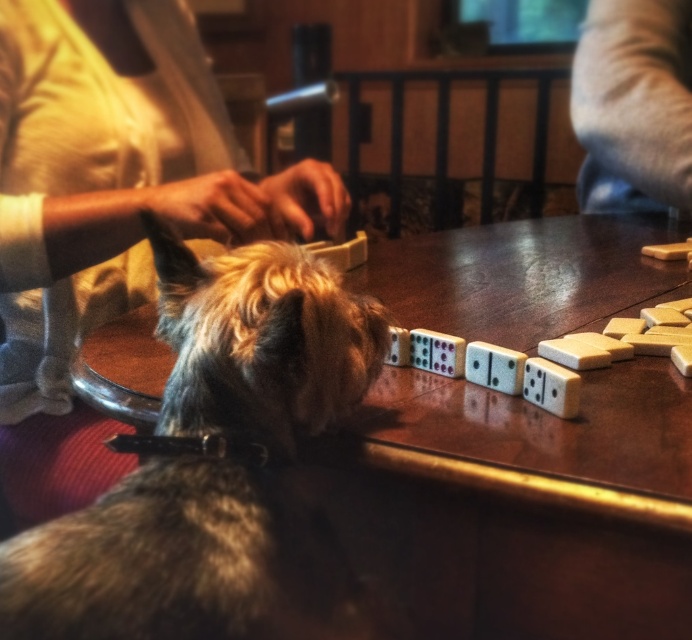
You are a player sitting at the table and want to reach for a domino piece that is near the fuzzy fur dog at lower left. Considering the dog is 16.06 inches away from you, is the dog close enough to potentially interfere with your reach?

The fuzzy fur dog at lower left is 16.06 inches away from the viewer, so yes, the dog is close enough to potentially interfere with your reach since it is within a typical arm reach distance.

You are a guest at a party and want to take a photo of the fuzzy fur dog at lower left without blocking the gray fabric at upper right. How should you position yourself?

Position yourself so that the fuzzy fur dog at lower left is below the gray fabric at upper right in the frame, ensuring the gray fabric at upper right remains unobstructed.

You are a photographer trying to capture the dog in the scene. The dog is at point (161, 561). If you want to focus on the dog, should you adjust your camera to focus on the foreground or background?

The point (161, 561) is on fuzzy fur dog at lower left, which is in the foreground. Therefore, you should adjust your camera to focus on the foreground to capture the dog clearly.